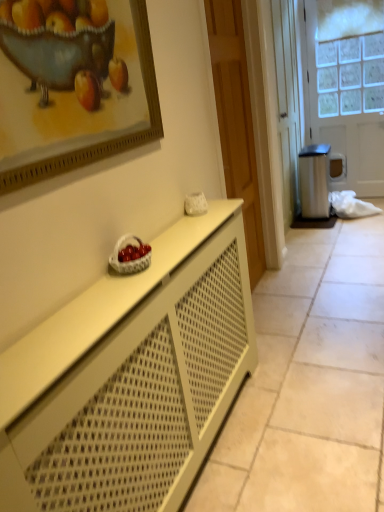
Question: From the image's perspective, is white matte cabinet at center beneath white wicker basket at center?

Choices:
 (A) yes
 (B) no

Answer: (A)

Question: Does white matte cabinet at center have a lesser width compared to white wicker basket at center?

Choices:
 (A) yes
 (B) no

Answer: (B)

Question: Is white wicker basket at center surrounded by white matte cabinet at center?

Choices:
 (A) yes
 (B) no

Answer: (B)

Question: Is white matte cabinet at center not close to white wicker basket at center?

Choices:
 (A) yes
 (B) no

Answer: (B)

Question: Is white matte cabinet at center bigger than white wicker basket at center?

Choices:
 (A) no
 (B) yes

Answer: (B)

Question: From a real-world perspective, is white wicker basket at center physically located above or below white frosted glass door at right, which is the 2th door from front to back?

Choices:
 (A) above
 (B) below

Answer: (B)

Question: Relative to white frosted glass door at right, which is counted as the first door, starting from the back, is white wicker basket at center in front or behind?

Choices:
 (A) front
 (B) behind

Answer: (A)

Question: Considering the positions of white wicker basket at center and white frosted glass door at right, which is the 2th door from front to back, in the image, is white wicker basket at center wider or thinner than white frosted glass door at right, which is the 2th door from front to back,?

Choices:
 (A) thin
 (B) wide

Answer: (A)

Question: Is white wicker basket at center bigger or smaller than white frosted glass door at right, which is counted as the first door, starting from the back?

Choices:
 (A) small
 (B) big

Answer: (A)

Question: Looking at their shapes, would you say wooden framed painting at upper left is wider or thinner than white wicker basket at center?

Choices:
 (A) thin
 (B) wide

Answer: (A)

Question: Considering the positions of wooden framed painting at upper left and white wicker basket at center in the image, is wooden framed painting at upper left taller or shorter than white wicker basket at center?

Choices:
 (A) tall
 (B) short

Answer: (A)

Question: From the image's perspective, is wooden framed painting at upper left above or below white wicker basket at center?

Choices:
 (A) above
 (B) below

Answer: (A)

Question: Considering the relative positions of wooden framed painting at upper left and white wicker basket at center in the image provided, is wooden framed painting at upper left to the left or to the right of white wicker basket at center?

Choices:
 (A) left
 (B) right

Answer: (A)

Question: Considering the positions of wooden door at center, acting as the first door starting from the left, and white wicker basket at center in the image, is wooden door at center, acting as the first door starting from the left, taller or shorter than white wicker basket at center?

Choices:
 (A) tall
 (B) short

Answer: (A)

Question: Is point (233, 27) positioned closer to the camera than point (132, 244)?

Choices:
 (A) closer
 (B) farther

Answer: (B)